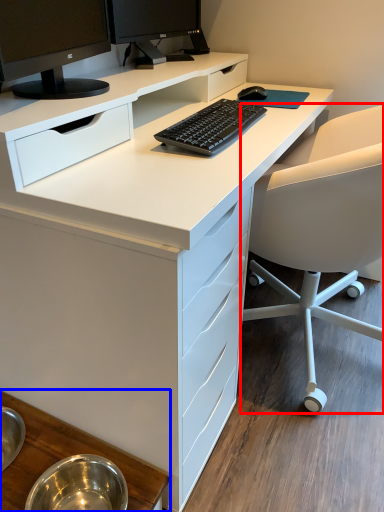
Question: Which point is closer to the camera, chair (highlighted by a red box) or table (highlighted by a blue box)?

Choices:
 (A) chair
 (B) table

Answer: (B)